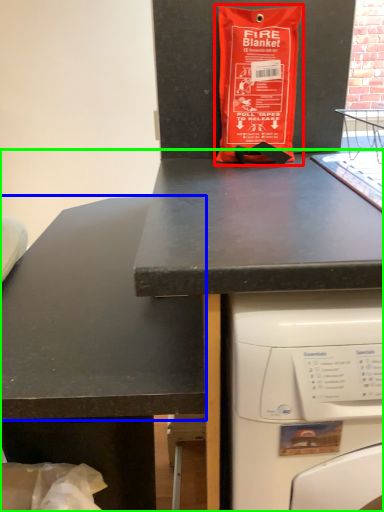
Question: Estimate the real-world distances between objects in this image. Which object is farther from bag (highlighted by a red box), counter top (highlighted by a blue box) or desk (highlighted by a green box)?

Choices:
 (A) counter top
 (B) desk

Answer: (A)